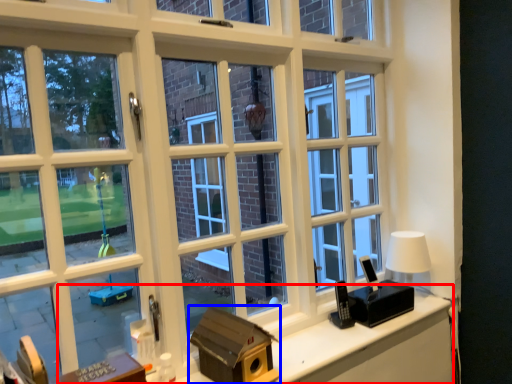
Question: Which point is further to the camera, computer desk (highlighted by a red box) or box (highlighted by a blue box)?

Choices:
 (A) computer desk
 (B) box

Answer: (B)